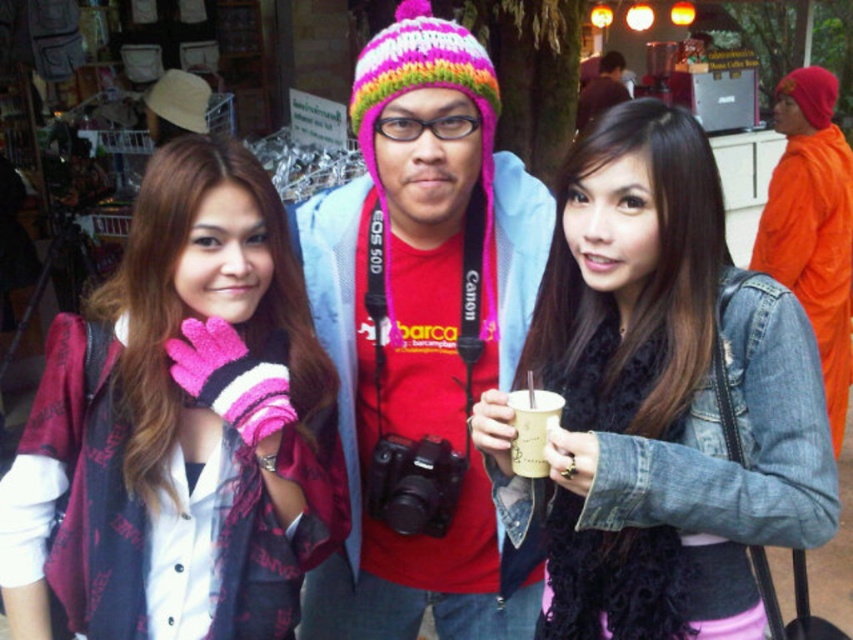
You are a photographer at the market. You need to place the pink knitted gloves at center and the white paper cup at center on a shelf. Which object should you place first to ensure they both fit on the shelf?

The pink knitted gloves at center is much taller than the white paper cup at center, so you should place the white paper cup at center first to ensure they both fit on the shelf.

You are trying to decide which item to take with you for a quick errand. You need to know which is thinner between the denim jacket at center and the knitted woolen hat at center. Which one is thinner?

The denim jacket at center is thinner than the knitted woolen hat at center, so you should take the denim jacket at center.